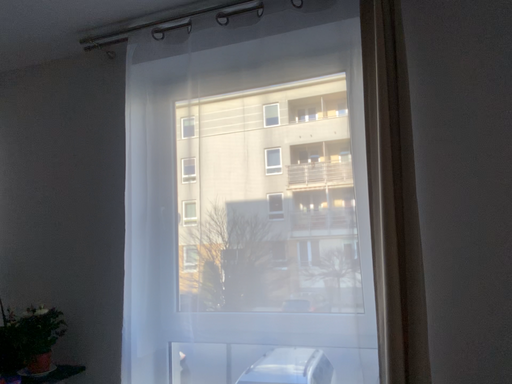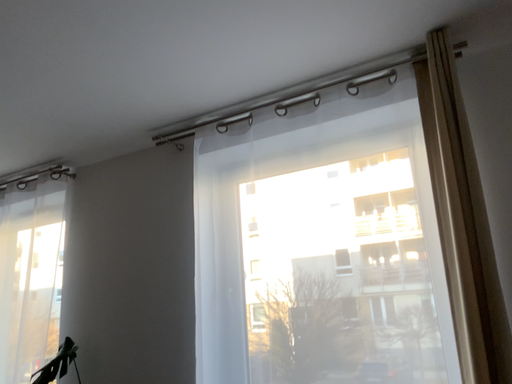
Question: How did the camera likely rotate when shooting the video?

Choices:
 (A) rotated upward
 (B) rotated downward

Answer: (A)